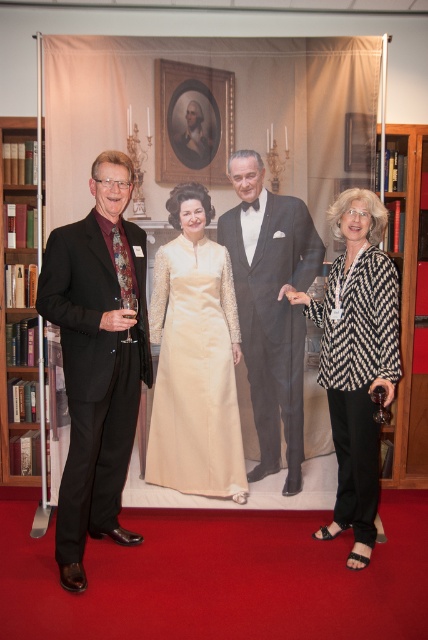
You are standing in front of the scene and want to touch the two points labeled as point (73, 452) and point (344, 464). Which point would require you to reach further back to touch?

Point (344, 464) would require reaching further back because it is farther from the camera compared to point (73, 452).

You are standing in front of the photograph and notice a specific point marked at coordinates (x=356, y=358). Based on the scene description, what object or feature in the image does this point correspond to?

The point at coordinates (x=356, y=358) corresponds to the patterned fabric blouse at right.

You are a photographer trying to adjust the lighting for a portrait. The scene includes a man in a dark suit with a maroon shirt and a patterned tie on the left and a woman wearing a patterned fabric blouse at right. Based on their positions, which subject should you focus the light on first to ensure proper exposure?

The patterned fabric blouse at right is positioned at point (x=356, y=358), so the photographer should focus the light on the woman wearing the patterned fabric blouse at right first to ensure proper exposure.